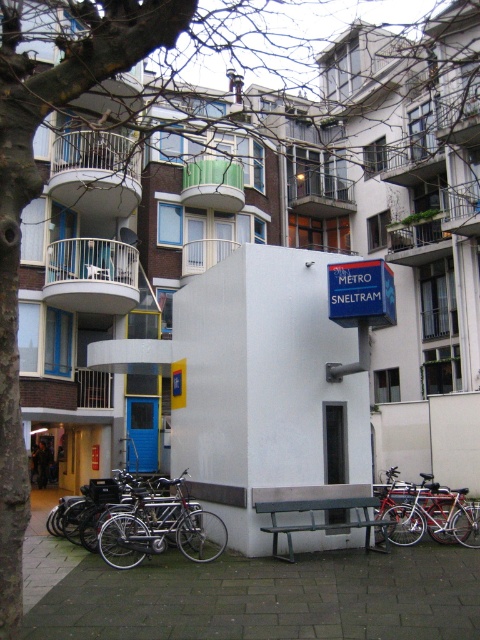
Question: Which point is closer to the camera?

Choices:
 (A) shiny metallic bicycle at lower right
 (B) silver metallic bicycle at lower center

Answer: (B)

Question: Does silver metallic bicycle at lower center lie behind shiny metallic bicycle at lower right?

Choices:
 (A) yes
 (B) no

Answer: (B)

Question: Which point is farther to the camera?

Choices:
 (A) (448, 531)
 (B) (135, 536)

Answer: (A)

Question: Is silver metallic bicycle at lower center positioned in front of shiny metallic bicycle at lower right?

Choices:
 (A) yes
 (B) no

Answer: (A)

Question: Can you confirm if silver metallic bicycle at lower center is positioned above shiny metallic bicycle at lower right?

Choices:
 (A) no
 (B) yes

Answer: (B)